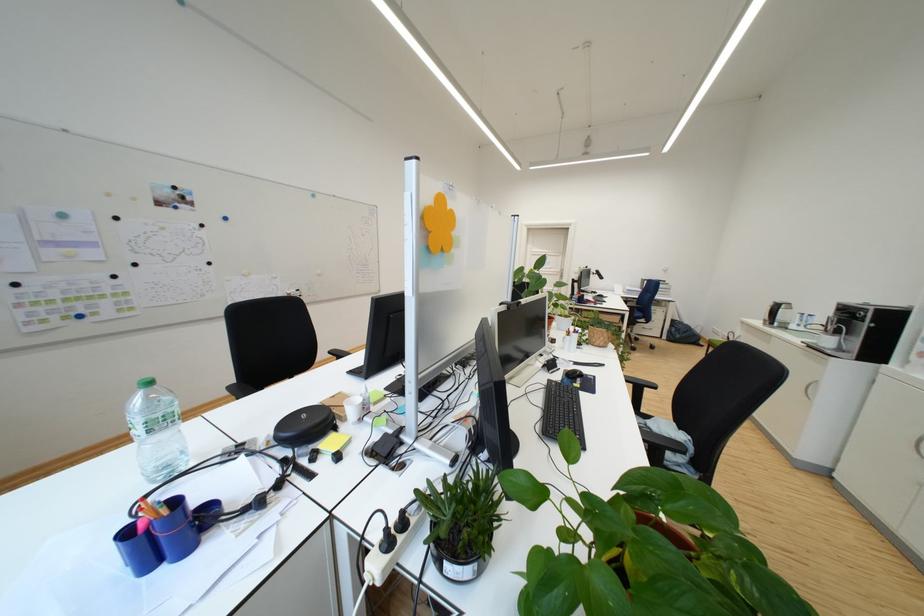
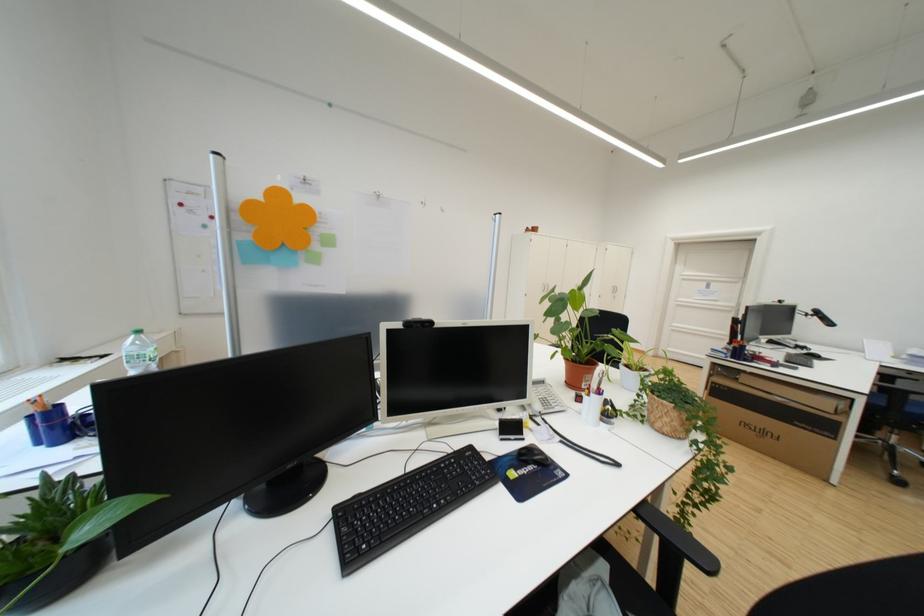
The point at (578, 382) is marked in the first image. Where is the corresponding point in the second image?

(517, 461)